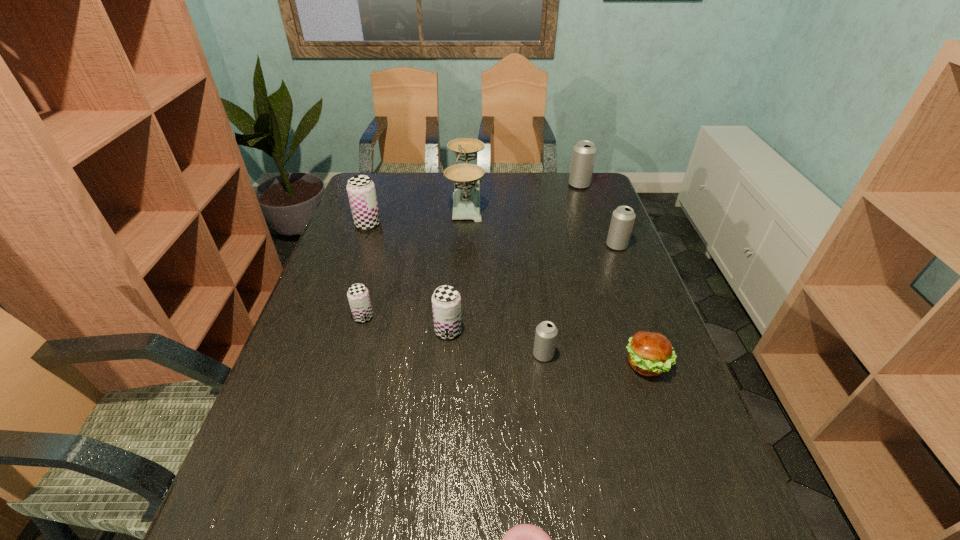
Locate an element on the screen. The image size is (960, 540). white beer can that is the closest one to the second farthest white beer can is located at coordinates (584, 152).

You are a GUI agent. You are given a task and a screenshot of the screen. Output one action in this format:
    pyautogui.click(x=<x>, y=<y>)
    Task: Click on the white beer can that is the closest to the fourth nearest beer can
    This screenshot has width=960, height=540.
    Given the screenshot: What is the action you would take?
    pyautogui.click(x=584, y=152)

Find the location of a particular element. This screenshot has width=960, height=540. the closest purple beer can to the nearest object is located at coordinates (446, 301).

Identify which purple beer can is located as the second nearest to the tallest object. Please provide its 2D coordinates. Your answer should be formatted as a tuple, i.e. [(x, y)], where the tuple contains the x and y coordinates of a point satisfying the conditions above.

[(358, 296)]

Where is `vacant space that satisfies the following two spatial constraints: 1. on the front side of the smallest white beer can; 2. on the right side of the second smallest purple beer can`? The width and height of the screenshot is (960, 540). vacant space that satisfies the following two spatial constraints: 1. on the front side of the smallest white beer can; 2. on the right side of the second smallest purple beer can is located at coordinates (446, 355).

Identify the location of free spot that satisfies the following two spatial constraints: 1. on the front-facing side of the tallest object; 2. on the left side of the nearest white beer can. (459, 355).

Image resolution: width=960 pixels, height=540 pixels. Find the location of `vacant space that satisfies the following two spatial constraints: 1. on the back side of the leftmost white beer can; 2. on the front-facing side of the scale`. vacant space that satisfies the following two spatial constraints: 1. on the back side of the leftmost white beer can; 2. on the front-facing side of the scale is located at coordinates (522, 198).

Identify the location of free space that satisfies the following two spatial constraints: 1. on the front-facing side of the tallest object; 2. on the back side of the fourth nearest beer can. click(x=464, y=246).